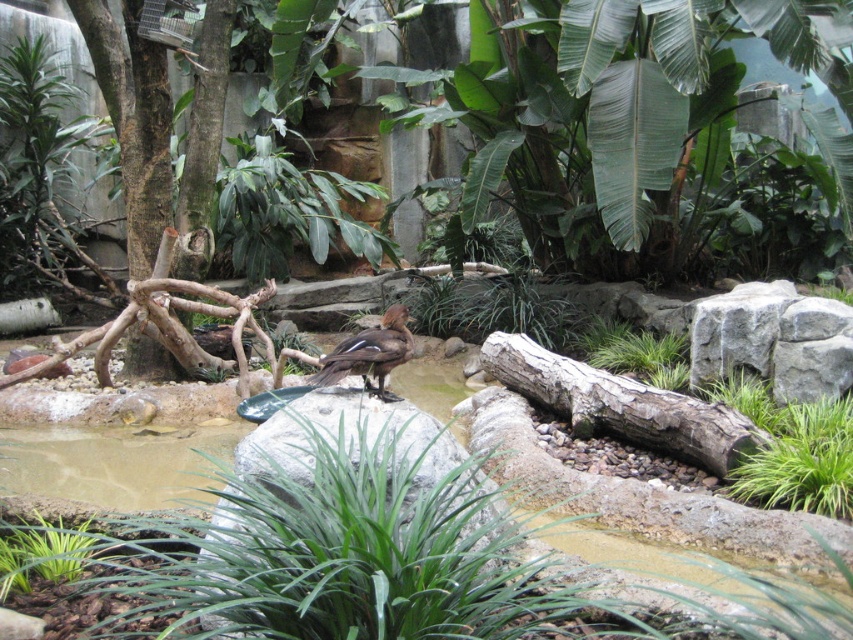
Who is more forward, (45, 556) or (379, 332)?

Point (45, 556) is in front.

Does green leafy plant at lower left have a greater height compared to brown feathered bird at center?

Incorrect, green leafy plant at lower left's height is not larger of brown feathered bird at center's.

Describe the element at coordinates (42, 554) in the screenshot. The image size is (853, 640). I see `green leafy plant at lower left` at that location.

You are a GUI agent. You are given a task and a screenshot of the screen. Output one action in this format:
    pyautogui.click(x=<x>, y=<y>)
    Task: Click on the green leafy plant at lower left
    Image resolution: width=853 pixels, height=640 pixels.
    Given the screenshot: What is the action you would take?
    pyautogui.click(x=42, y=554)

Is the position of weathered wood log at center-right more distant than that of green leafy plant at lower left?

That is True.

What do you see at coordinates (621, 404) in the screenshot? I see `weathered wood log at center-right` at bounding box center [621, 404].

This screenshot has width=853, height=640. I want to click on weathered wood log at center-right, so click(621, 404).

Is point (695, 451) in front of point (393, 321)?

No.

Consider the image. Measure the distance between weathered wood log at center-right and brown feathered bird at center.

A distance of 2.34 meters exists between weathered wood log at center-right and brown feathered bird at center.

Locate an element on the screen. The width and height of the screenshot is (853, 640). weathered wood log at center-right is located at coordinates (621, 404).